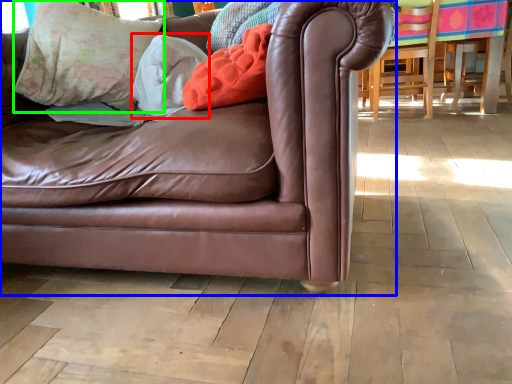
Question: Which object is positioned closest to pillow (highlighted by a red box)? Select from studio couch (highlighted by a blue box) and pillow (highlighted by a green box).

Choices:
 (A) studio couch
 (B) pillow

Answer: (B)